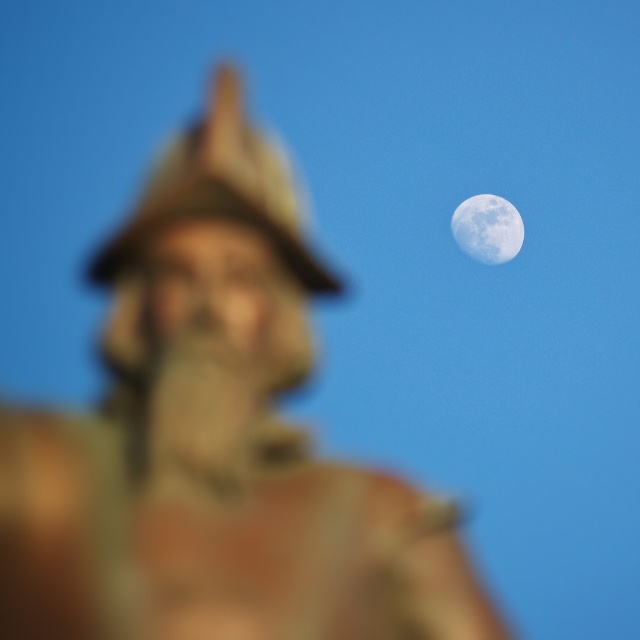
Question: Which of the following is the closest to the observer?

Choices:
 (A) matte stone statue at upper right
 (B) smooth white moon at upper right

Answer: (A)

Question: Which point is closer to the camera?

Choices:
 (A) smooth white moon at upper right
 (B) matte stone statue at upper right

Answer: (B)

Question: Does matte stone statue at upper right have a larger size compared to smooth white moon at upper right?

Choices:
 (A) no
 (B) yes

Answer: (A)

Question: Can you confirm if matte stone statue at upper right is bigger than smooth white moon at upper right?

Choices:
 (A) no
 (B) yes

Answer: (A)

Question: Does matte stone statue at upper right appear on the right side of smooth white moon at upper right?

Choices:
 (A) yes
 (B) no

Answer: (B)